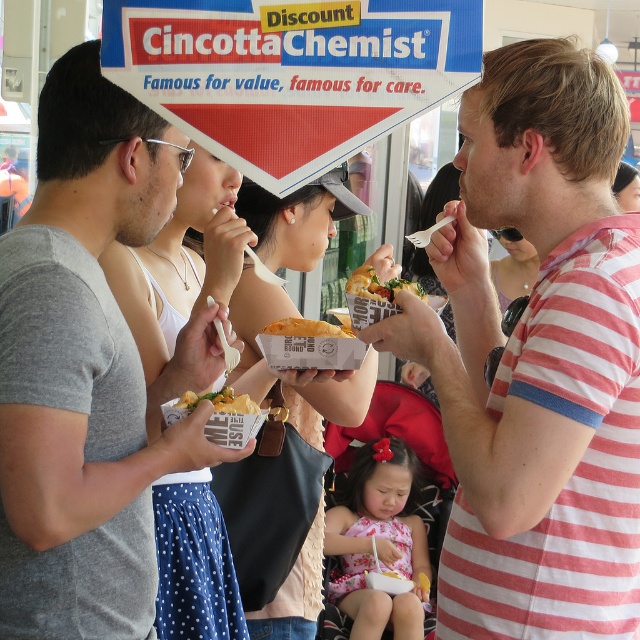
Which is in front, point (131, 612) or point (352, 333)?

Positioned in front is point (131, 612).

At what (x,y) coordinates should I click in order to perform the action: click on gray matte t-shirt at left. Please return your answer as a coordinate pair (x, y). The height and width of the screenshot is (640, 640). Looking at the image, I should click on (83, 369).

Between gray matte t-shirt at left and golden crispy fries at center, which one has more height?

With more height is gray matte t-shirt at left.

Is gray matte t-shirt at left to the left of golden crispy fries at center from the viewer's perspective?

Yes, gray matte t-shirt at left is to the left of golden crispy fries at center.

In order to click on gray matte t-shirt at left in this screenshot , I will do `click(83, 369)`.

Which is more to the left, striped cotton shirt at right or golden crispy bread at center?

From the viewer's perspective, golden crispy bread at center appears more on the left side.

Image resolution: width=640 pixels, height=640 pixels. What do you see at coordinates (538, 356) in the screenshot? I see `striped cotton shirt at right` at bounding box center [538, 356].

The height and width of the screenshot is (640, 640). What are the coordinates of `striped cotton shirt at right` in the screenshot? It's located at (538, 356).